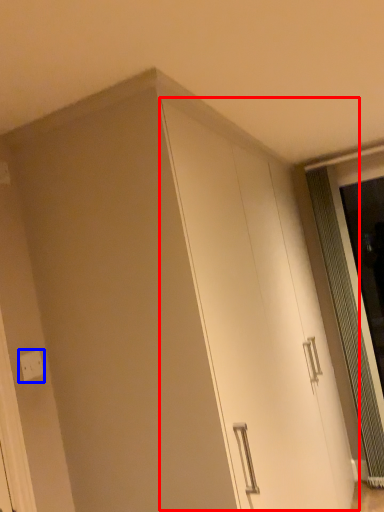
Question: Which of the following is the farthest to the observer, cabinetry (highlighted by a red box) or electric outlet (highlighted by a blue box)?

Choices:
 (A) cabinetry
 (B) electric outlet

Answer: (B)